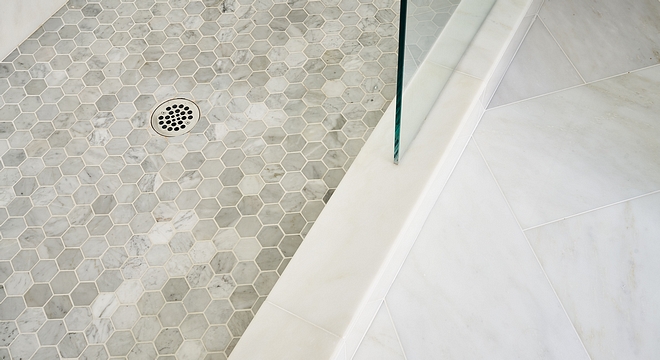
The width and height of the screenshot is (660, 360). What are the coordinates of `shower wall` in the screenshot? It's located at (16, 15).